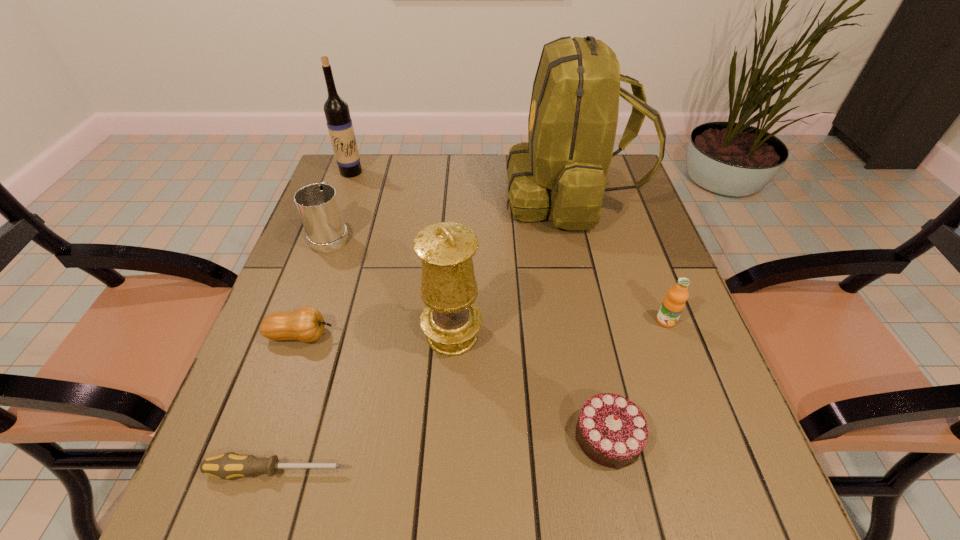
The height and width of the screenshot is (540, 960). In order to click on orange juice at the right edge in this screenshot , I will do `click(673, 304)`.

Find the location of a particular element. The height and width of the screenshot is (540, 960). object that is at the far left corner is located at coordinates (339, 122).

Locate an element on the screen. The width and height of the screenshot is (960, 540). object located at the near left corner is located at coordinates (225, 466).

This screenshot has width=960, height=540. I want to click on object located at the far right corner, so click(x=562, y=170).

At what (x,y) coordinates should I click in order to perform the action: click on free space at the far edge. Please return your answer as a coordinate pair (x, y). Looking at the image, I should click on tap(410, 194).

Locate an element on the screen. vacant region at the near edge of the desktop is located at coordinates (570, 488).

Locate an element on the screen. vacant space at the left edge of the desktop is located at coordinates (320, 397).

Where is `free spot at the right edge of the desktop`? free spot at the right edge of the desktop is located at coordinates click(x=614, y=292).

Locate an element on the screen. Image resolution: width=960 pixels, height=540 pixels. free location at the far left corner of the desktop is located at coordinates click(x=347, y=191).

In the image, there is a desktop. At what (x,y) coordinates should I click in order to perform the action: click on vacant space at the near right corner. Please return your answer as a coordinate pair (x, y). Looking at the image, I should click on (697, 511).